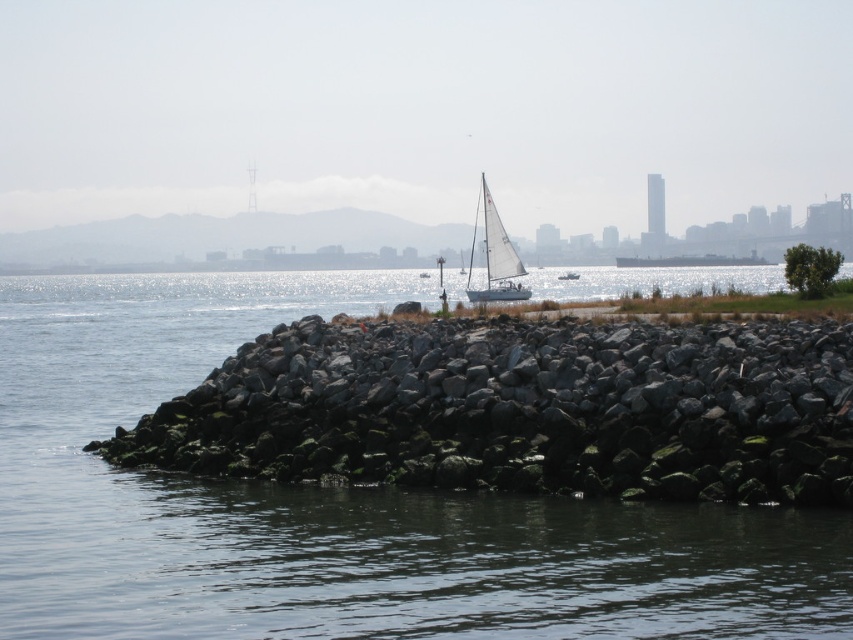
Is gray rock at center shorter than white matte sailboat at center?

Yes, gray rock at center is shorter than white matte sailboat at center.

Does gray rock at center have a larger size compared to white matte sailboat at center?

No, gray rock at center is not bigger than white matte sailboat at center.

The width and height of the screenshot is (853, 640). Find the location of `gray rock at center`. gray rock at center is located at coordinates (523, 410).

Identify the location of gray rock at center. (523, 410).

Between point (434, 586) and point (849, 348), which one is positioned in front?

Point (434, 586) is in front.

Does smooth gray water at center have a lesser height compared to gray rock at center?

No, smooth gray water at center is not shorter than gray rock at center.

Is point (3, 563) positioned before point (788, 422)?

That is True.

The height and width of the screenshot is (640, 853). Identify the location of smooth gray water at center. (334, 506).

Does gray rock at center have a greater height compared to white sailboat at center?

Incorrect, gray rock at center's height is not larger of white sailboat at center's.

Does gray rock at center appear over white sailboat at center?

Actually, gray rock at center is below white sailboat at center.

The width and height of the screenshot is (853, 640). What are the coordinates of `gray rock at center` in the screenshot? It's located at (523, 410).